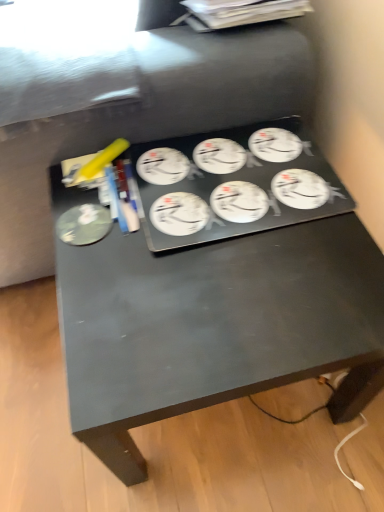
Locate an element on the screen. This screenshot has width=384, height=512. black matte tray at center is located at coordinates (220, 305).

Describe the element at coordinates (220, 305) in the screenshot. The image size is (384, 512). I see `black matte tray at center` at that location.

In order to face black matte tray at center, should I rotate leftwards or rightwards?

You should rotate right by 4.057 degrees.

At what (x,y) coordinates should I click in order to perform the action: click on black matte tray at center. Please return your answer as a coordinate pair (x, y). Looking at the image, I should click on (220, 305).